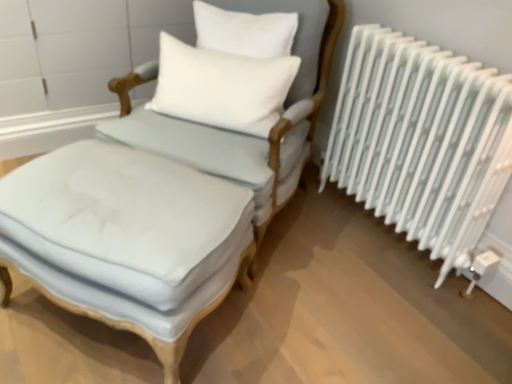
Locate an element on the screen. The height and width of the screenshot is (384, 512). free location to the right of light blue fabric ottoman at center is located at coordinates (310, 305).